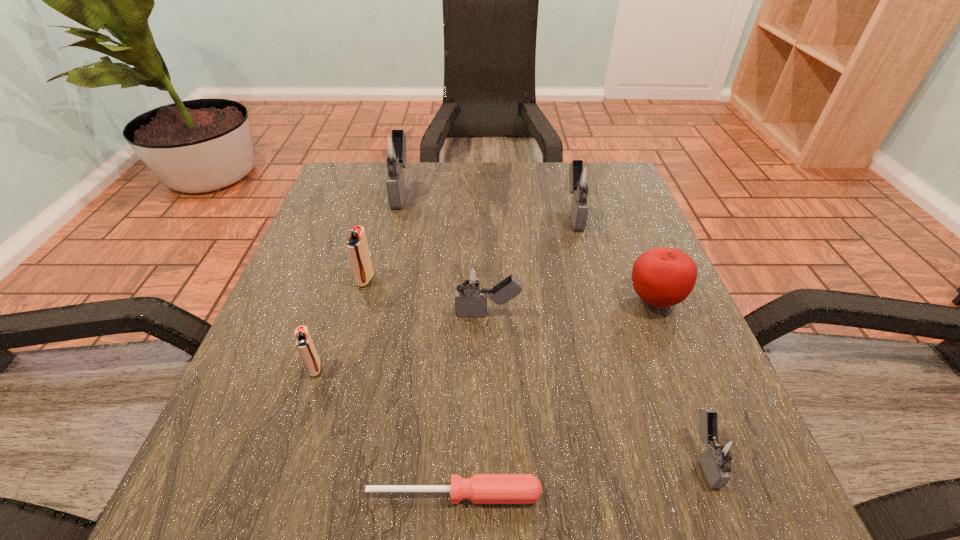
What are the coordinates of `the leftmost gray igniter` in the screenshot? It's located at (391, 148).

Locate an element on the screen. The image size is (960, 540). the tallest object is located at coordinates (391, 148).

Identify the location of the second igniter from right to left. (583, 180).

The image size is (960, 540). Identify the location of the third gray igniter from left to right. (583, 180).

At what (x,y) coordinates should I click in order to perform the action: click on the third gray igniter from right to left. Please return your answer as a coordinate pair (x, y). Looking at the image, I should click on (471, 281).

Identify the location of the second nearest gray igniter. (471, 281).

At what (x,y) coordinates should I click in order to perform the action: click on the right red igniter. Please return your answer as a coordinate pair (x, y). This screenshot has height=540, width=960. Looking at the image, I should click on (357, 247).

At what (x,y) coordinates should I click in order to perform the action: click on the bigger red igniter. Please return your answer as a coordinate pair (x, y). Looking at the image, I should click on (357, 247).

Image resolution: width=960 pixels, height=540 pixels. I want to click on red apple, so click(662, 277).

The height and width of the screenshot is (540, 960). Find the location of `the leftmost igniter`. the leftmost igniter is located at coordinates (304, 343).